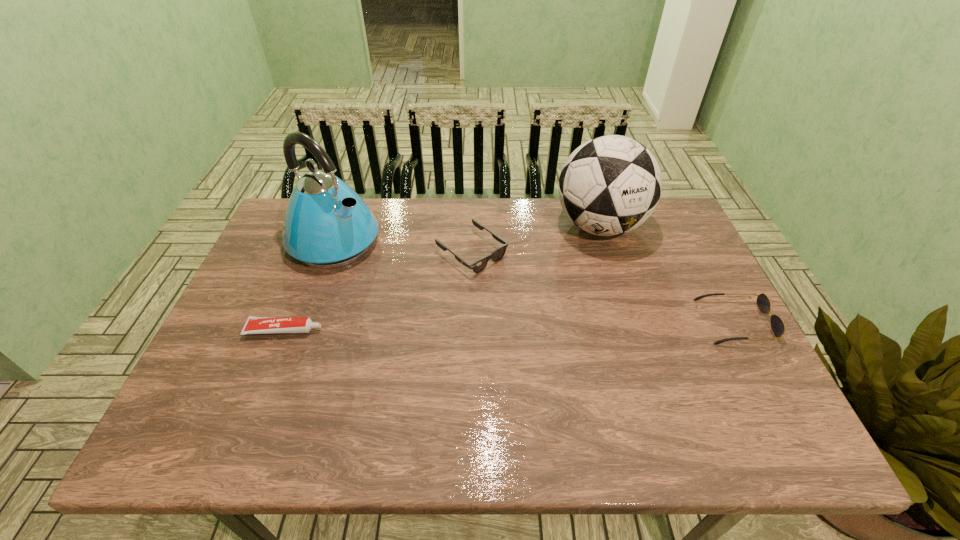
At what (x,y) coordinates should I click in order to perform the action: click on free space on the desktop that is between the shortest object and the rightmost object and is positioned on the surface of the fourth shortest object where the brand logo is visible. Please return your answer as a coordinate pair (x, y). Looking at the image, I should click on (572, 325).

Image resolution: width=960 pixels, height=540 pixels. In order to click on vacant space on the desktop that is between the shortest object and the rightmost object and is positioned at the spout of the kettle in this screenshot , I will do `click(481, 327)`.

You are a GUI agent. You are given a task and a screenshot of the screen. Output one action in this format:
    pyautogui.click(x=<x>, y=<y>)
    Task: Click on the vacant space on the desktop that is between the toothpaste and the rightmost object and is positioned on the temples of the farther sunglasses
    This screenshot has height=540, width=960.
    Given the screenshot: What is the action you would take?
    pyautogui.click(x=566, y=325)